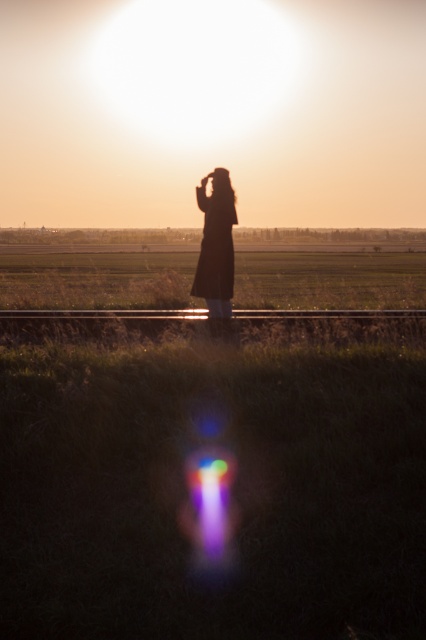
Question: Which of the following is the farthest from the observer?

Choices:
 (A) metallic train track at center
 (B) silhouette coat at center

Answer: (A)

Question: Is silhouette coat at center to the left of metallic train track at center from the viewer's perspective?

Choices:
 (A) yes
 (B) no

Answer: (A)

Question: Can you confirm if silhouette coat at center is wider than metallic train track at center?

Choices:
 (A) no
 (B) yes

Answer: (B)

Question: Among these objects, which one is farthest from the camera?

Choices:
 (A) metallic train track at center
 (B) silhouette coat at center

Answer: (A)

Question: In this image, where is silhouette coat at center located relative to metallic train track at center?

Choices:
 (A) right
 (B) left

Answer: (B)